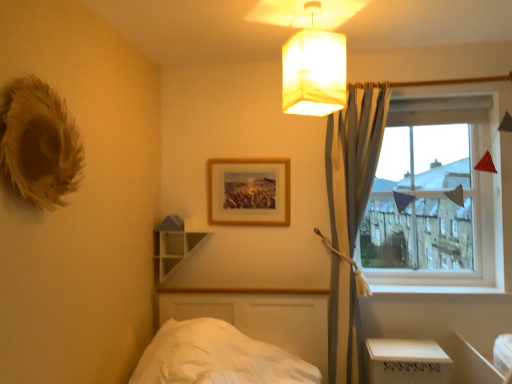
The width and height of the screenshot is (512, 384). Describe the element at coordinates (314, 70) in the screenshot. I see `matte white lampshade at upper center` at that location.

The image size is (512, 384). Describe the element at coordinates (438, 193) in the screenshot. I see `clear glass window at right` at that location.

What is the approximate width of light gray fabric curtain at upper right?

22.17 centimeters.

Describe the element at coordinates (174, 244) in the screenshot. This screenshot has width=512, height=384. I see `green matte shelf at upper center` at that location.

Locate an element on the screen. matte white lampshade at upper center is located at coordinates (314, 70).

Looking at this image, is matte white lampshade at upper center to the left of white plastic table at lower right from the viewer's perspective?

Yes.

Is matte white lampshade at upper center aimed at white plastic table at lower right?

No, matte white lampshade at upper center does not turn towards white plastic table at lower right.

How much distance is there between matte white lampshade at upper center and white plastic table at lower right?

4.56 feet.

From their relative heights in the image, would you say matte white lampshade at upper center is taller or shorter than white plastic table at lower right?

In the image, matte white lampshade at upper center appears to be taller than white plastic table at lower right.

From the image's perspective, relative to light gray fabric curtain at upper right, is green matte shelf at upper center above or below?

From the image's perspective, green matte shelf at upper center appears below light gray fabric curtain at upper right.

Identify the location of curtain lying on the right of green matte shelf at upper center. The width and height of the screenshot is (512, 384). [x=353, y=160].

Is point (170, 253) closer or farther from the camera than point (347, 349)?

Point (170, 253) is positioned farther from the camera compared to point (347, 349).

Who is smaller, white plastic table at lower right or light gray fabric curtain at upper right?

Smaller between the two is white plastic table at lower right.

From a real-world perspective, between white plastic table at lower right and light gray fabric curtain at upper right, who is vertically higher?

light gray fabric curtain at upper right.

Is white plastic table at lower right in front of or behind light gray fabric curtain at upper right in the image?

Clearly, white plastic table at lower right is in front of light gray fabric curtain at upper right.

Is white plastic table at lower right wider than light gray fabric curtain at upper right?

Yes, white plastic table at lower right is wider than light gray fabric curtain at upper right.

Does point (250, 205) appear closer or farther from the camera than point (332, 219)?

Point (250, 205) is positioned farther from the camera compared to point (332, 219).

Measure the distance between wooden picture frame at upper center and light gray fabric curtain at upper right.

wooden picture frame at upper center and light gray fabric curtain at upper right are 20.32 inches apart from each other.

From a real-world perspective, is wooden picture frame at upper center physically below light gray fabric curtain at upper right?

No.

Which object is further away from the camera taking this photo, wooden picture frame at upper center or light gray fabric curtain at upper right?

wooden picture frame at upper center.

Does white plastic table at lower right appear on the left side of matte white lampshade at upper center?

In fact, white plastic table at lower right is to the right of matte white lampshade at upper center.

Is white plastic table at lower right directly adjacent to matte white lampshade at upper center?

No, white plastic table at lower right is not next to matte white lampshade at upper center.

Which of these two, white plastic table at lower right or matte white lampshade at upper center, is wider?

Wider between the two is white plastic table at lower right.

Is white plastic table at lower right in front of or behind matte white lampshade at upper center in the image?

white plastic table at lower right is behind matte white lampshade at upper center.

What's the angular difference between clear glass window at right and matte white lampshade at upper center's facing directions?

clear glass window at right and matte white lampshade at upper center are facing 26.3 degrees away from each other.

Based on their sizes in the image, would you say clear glass window at right is bigger or smaller than matte white lampshade at upper center?

In the image, clear glass window at right appears to be larger than matte white lampshade at upper center.

Does clear glass window at right touch matte white lampshade at upper center?

clear glass window at right is not next to matte white lampshade at upper center, and they're not touching.

Which object is further away from the camera taking this photo, light gray fabric curtain at upper right or matte white lampshade at upper center?

Positioned behind is light gray fabric curtain at upper right.

Is matte white lampshade at upper center surrounded by light gray fabric curtain at upper right?

No.

From the image's perspective, between light gray fabric curtain at upper right and matte white lampshade at upper center, which one is located above?

matte white lampshade at upper center is shown above in the image.

At what (x,y) coordinates should I click in order to perform the action: click on table below the matte white lampshade at upper center (from the image's perspective). Please return your answer as a coordinate pair (x, y). The height and width of the screenshot is (384, 512). Looking at the image, I should click on (407, 361).

This screenshot has width=512, height=384. What are the coordinates of `shelf that is under the light gray fabric curtain at upper right (from a real-world perspective)` in the screenshot? It's located at tap(174, 244).

Considering their positions, is matte white lampshade at upper center positioned closer to wooden picture frame at upper center than green matte shelf at upper center?

green matte shelf at upper center lies closer to wooden picture frame at upper center than the other object.

Considering their positions, is green matte shelf at upper center positioned further to wooden picture frame at upper center than clear glass window at right?

clear glass window at right.

Estimate the real-world distances between objects in this image. Which object is closer to matte white lampshade at upper center, white plastic table at lower right or light gray fabric curtain at upper right?

Based on the image, light gray fabric curtain at upper right appears to be nearer to matte white lampshade at upper center.

Which object lies further to the anchor point white plastic table at lower right, green matte shelf at upper center or matte white lampshade at upper center?

matte white lampshade at upper center.

In the scene shown: Estimate the real-world distances between objects in this image. Which object is closer to clear glass window at right, wooden picture frame at upper center or light gray fabric curtain at upper right?

Based on the image, light gray fabric curtain at upper right appears to be nearer to clear glass window at right.

When comparing their distances from green matte shelf at upper center, does white plastic table at lower right or wooden picture frame at upper center seem further?

white plastic table at lower right is positioned further to the anchor green matte shelf at upper center.

Which object lies further to the anchor point white plastic table at lower right, light gray fabric curtain at upper right or matte white lampshade at upper center?

Among the two, matte white lampshade at upper center is located further to white plastic table at lower right.

Estimate the real-world distances between objects in this image. Which object is closer to white plastic table at lower right, matte white lampshade at upper center or light gray fabric curtain at upper right?

Among the two, light gray fabric curtain at upper right is located nearer to white plastic table at lower right.

In order to click on picture frame between matte white lampshade at upper center and white plastic table at lower right vertically in this screenshot , I will do `click(249, 192)`.

The image size is (512, 384). Identify the location of lamp situated between wooden picture frame at upper center and clear glass window at right from left to right. (314, 70).

I want to click on window that lies between matte white lampshade at upper center and light gray fabric curtain at upper right from top to bottom, so (438, 193).

The image size is (512, 384). I want to click on window that lies between matte white lampshade at upper center and white plastic table at lower right from top to bottom, so click(x=438, y=193).